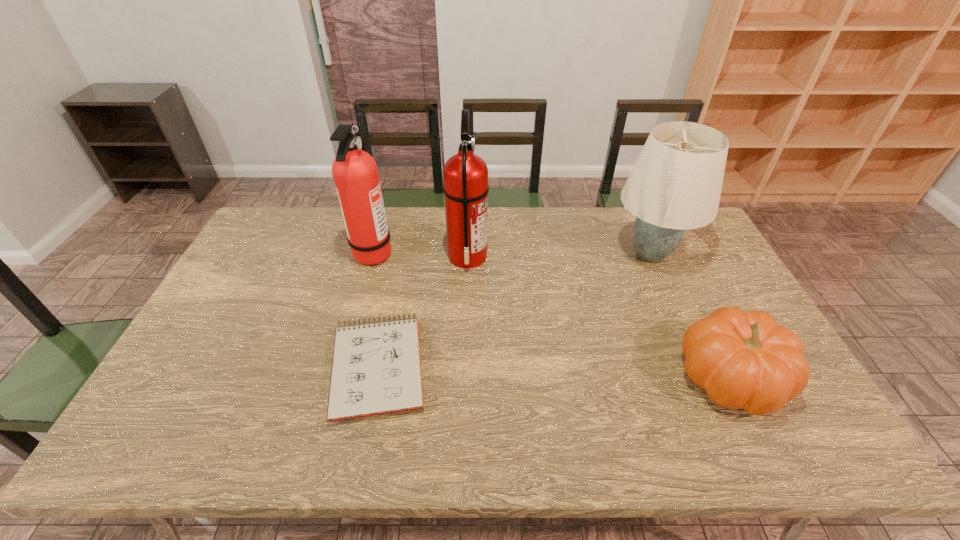
This screenshot has height=540, width=960. What are the coordinates of `free space at the right edge` in the screenshot? It's located at (704, 292).

Locate an element on the screen. The image size is (960, 540). vacant point at the far left corner is located at coordinates (279, 211).

This screenshot has width=960, height=540. In the image, there is a desktop. Find the location of `vacant space at the far right corner`. vacant space at the far right corner is located at coordinates (685, 236).

The height and width of the screenshot is (540, 960). Identify the location of free area in between the right fire extinguisher and the shortest object. (423, 312).

Image resolution: width=960 pixels, height=540 pixels. Find the location of `free space between the left fire extinguisher and the right fire extinguisher`. free space between the left fire extinguisher and the right fire extinguisher is located at coordinates (420, 254).

Locate an element on the screen. Image resolution: width=960 pixels, height=540 pixels. unoccupied area between the shortest object and the left fire extinguisher is located at coordinates (376, 309).

The width and height of the screenshot is (960, 540). What are the coordinates of `unoccupied area between the left fire extinguisher and the third object from left to right` in the screenshot? It's located at (420, 254).

Find the location of a particular element. This screenshot has width=960, height=540. free point between the second shortest object and the shortest object is located at coordinates (554, 372).

Locate an element on the screen. The image size is (960, 540). vacant point located between the notepad and the left fire extinguisher is located at coordinates click(376, 309).

Where is `vacant space that is in between the pumpkin and the lampshade`? The image size is (960, 540). vacant space that is in between the pumpkin and the lampshade is located at coordinates (690, 316).